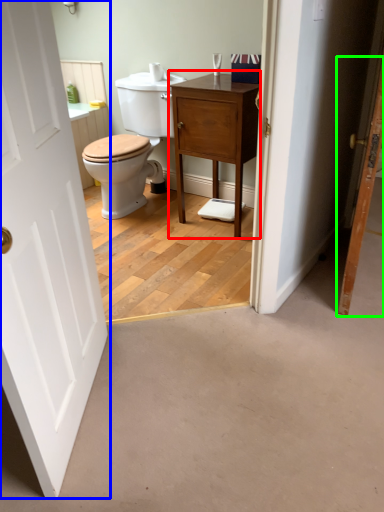
Question: Estimate the real-world distances between objects in this image. Which object is closer to nightstand (highlighted by a red box), door (highlighted by a blue box) or door (highlighted by a green box)?

Choices:
 (A) door
 (B) door

Answer: (B)